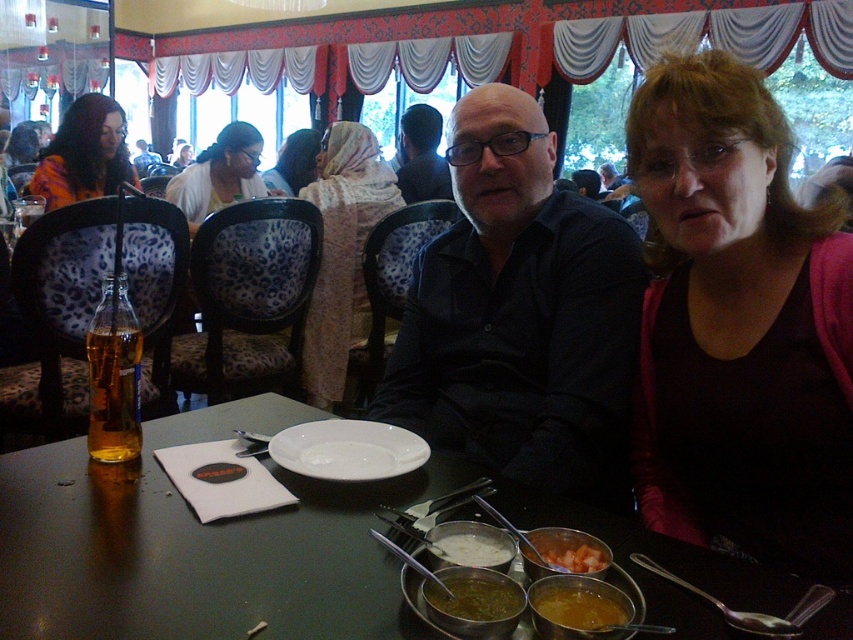
Is shiny black table at center further to camera compared to light beige fabric headscarf at center?

No, shiny black table at center is in front of light beige fabric headscarf at center.

Locate an element on the screen. The height and width of the screenshot is (640, 853). shiny black table at center is located at coordinates (199, 545).

The image size is (853, 640). Find the location of `shiny black table at center`. shiny black table at center is located at coordinates (199, 545).

Is light beige fabric headscarf at center to the right of yellowish-brown paste at lower center from the viewer's perspective?

No, light beige fabric headscarf at center is not to the right of yellowish-brown paste at lower center.

Is light beige fabric headscarf at center shorter than yellowish-brown paste at lower center?

No, light beige fabric headscarf at center is not shorter than yellowish-brown paste at lower center.

I want to click on light beige fabric headscarf at center, so click(x=341, y=252).

Does translucent amber liquid at table left have a smaller size compared to matte white blouse at center?

Indeed, translucent amber liquid at table left has a smaller size compared to matte white blouse at center.

Can you confirm if translucent amber liquid at table left is positioned above matte white blouse at center?

No.

Which is behind, point (138, 417) or point (200, 211)?

The point (200, 211) is behind.

Where is `translucent amber liquid at table left`? The height and width of the screenshot is (640, 853). translucent amber liquid at table left is located at coordinates (113, 390).